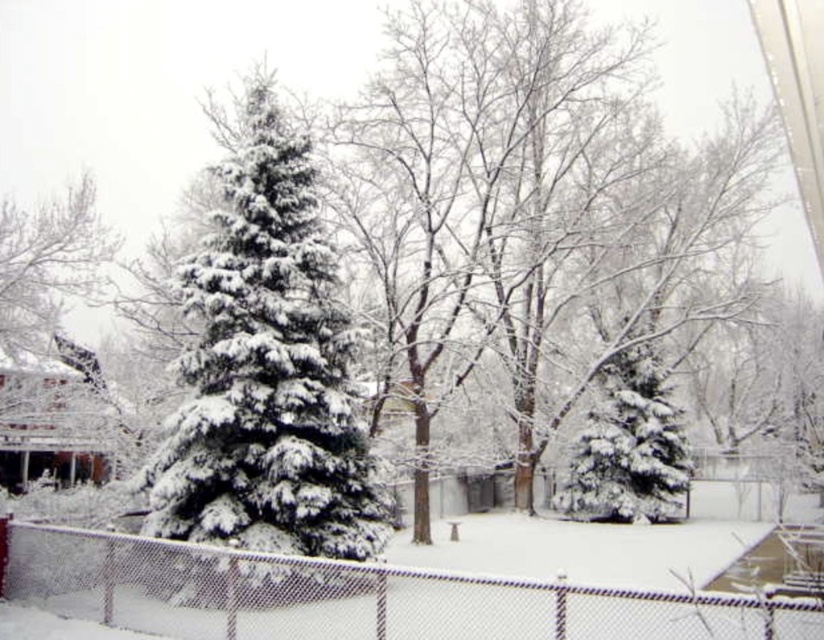
Is green matte/fuzzy fir tree at center smaller than snow-covered fir tree at center-right?

Indeed, green matte/fuzzy fir tree at center has a smaller size compared to snow-covered fir tree at center-right.

What do you see at coordinates (265, 371) in the screenshot? I see `green matte/fuzzy fir tree at center` at bounding box center [265, 371].

This screenshot has height=640, width=824. What are the coordinates of `green matte/fuzzy fir tree at center` in the screenshot? It's located at (265, 371).

Does green matte/fuzzy fir tree at center have a larger size compared to white chain-link fence at center?

Actually, green matte/fuzzy fir tree at center might be smaller than white chain-link fence at center.

Image resolution: width=824 pixels, height=640 pixels. Find the location of `green matte/fuzzy fir tree at center`. green matte/fuzzy fir tree at center is located at coordinates tap(265, 371).

Locate an element on the screen. This screenshot has height=640, width=824. green matte/fuzzy fir tree at center is located at coordinates pos(265,371).

Can you confirm if white chain-link fence at center is positioned to the right of snow-covered fir tree at center-right?

No, white chain-link fence at center is not to the right of snow-covered fir tree at center-right.

Measure the distance between point (350, 637) and camera.

They are 9.71 meters apart.

Locate an element on the screen. The image size is (824, 640). white chain-link fence at center is located at coordinates (354, 596).